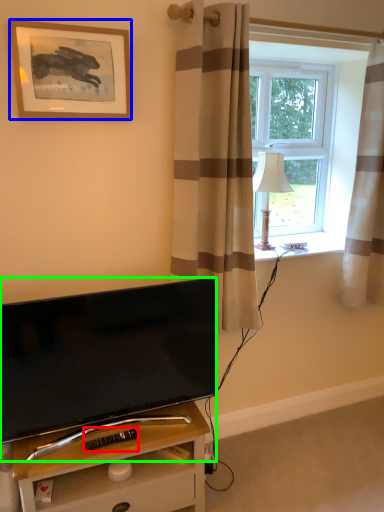
Question: Estimate the real-world distances between objects in this image. Which object is closer to remote control (highlighted by a red box), picture frame (highlighted by a blue box) or television (highlighted by a green box)?

Choices:
 (A) picture frame
 (B) television

Answer: (B)